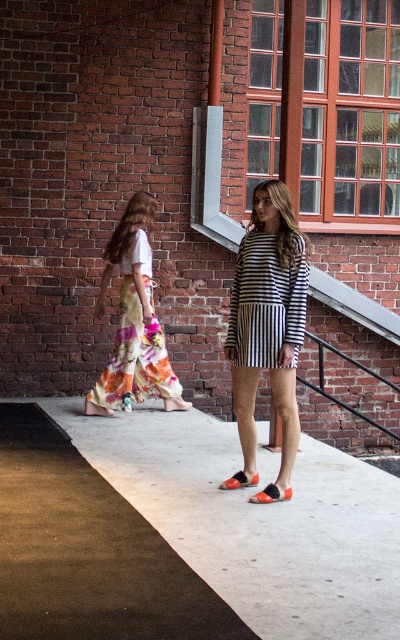
Question: Which object is closer to the camera taking this photo?

Choices:
 (A) floral cotton skirt at left
 (B) striped cotton dress at center
 (C) concrete sidewalk at center

Answer: (C)

Question: Is concrete sidewalk at center wider than matte orange sandal at lower center?

Choices:
 (A) no
 (B) yes

Answer: (B)

Question: Is concrete sidewalk at center closer to camera compared to striped cotton dress at center?

Choices:
 (A) no
 (B) yes

Answer: (B)

Question: Can you confirm if concrete sidewalk at center is thinner than striped cotton dress at center?

Choices:
 (A) no
 (B) yes

Answer: (A)

Question: Which object appears farthest from the camera in this image?

Choices:
 (A) concrete sidewalk at center
 (B) matte orange sandal at lower center

Answer: (B)

Question: Which object is positioned closest to the floral cotton skirt at left?

Choices:
 (A) orange leather sandal at lower center
 (B) concrete sidewalk at center

Answer: (B)